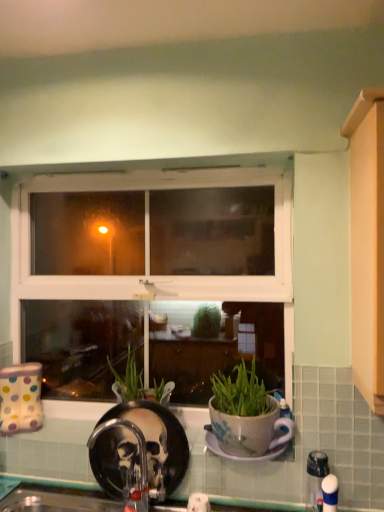
Question: From a real-world perspective, is black matte faucet at lower center, the 1th faucet from the back, below porcelain plate at center?

Choices:
 (A) no
 (B) yes

Answer: (B)

Question: Does black matte faucet at lower center, the 2th faucet positioned from the right, contain porcelain plate at center?

Choices:
 (A) no
 (B) yes

Answer: (A)

Question: From the image's perspective, would you say black matte faucet at lower center, the 1th faucet from the back, is positioned over porcelain plate at center?

Choices:
 (A) yes
 (B) no

Answer: (B)

Question: Is black matte faucet at lower center, the 1th faucet from the back, facing away from porcelain plate at center?

Choices:
 (A) yes
 (B) no

Answer: (B)

Question: Is the surface of black matte faucet at lower center, the 2th faucet positioned from the right, in direct contact with porcelain plate at center?

Choices:
 (A) no
 (B) yes

Answer: (A)

Question: Considering the relative positions of black matte faucet at lower center, the second faucet when ordered from front to back, and porcelain plate at center in the image provided, is black matte faucet at lower center, the second faucet when ordered from front to back, in front of porcelain plate at center?

Choices:
 (A) no
 (B) yes

Answer: (A)

Question: Considering the relative sizes of white plastic window at center and black matte faucet at lower center, the second faucet when ordered from front to back, in the image provided, is white plastic window at center wider than black matte faucet at lower center, the second faucet when ordered from front to back,?

Choices:
 (A) yes
 (B) no

Answer: (A)

Question: Can you confirm if white plastic window at center is shorter than black matte faucet at lower center, the second faucet when ordered from front to back?

Choices:
 (A) yes
 (B) no

Answer: (B)

Question: Considering the relative sizes of white plastic window at center and black matte faucet at lower center, the 1th faucet from the back, in the image provided, is white plastic window at center bigger than black matte faucet at lower center, the 1th faucet from the back,?

Choices:
 (A) no
 (B) yes

Answer: (B)

Question: Is the depth of white plastic window at center greater than that of black matte faucet at lower center, the second faucet when ordered from front to back?

Choices:
 (A) yes
 (B) no

Answer: (A)

Question: Can you see white plastic window at center touching black matte faucet at lower center, the 1th faucet positioned from the left?

Choices:
 (A) no
 (B) yes

Answer: (A)

Question: Does white plastic window at center have a smaller size compared to black matte faucet at lower center, the 2th faucet positioned from the right?

Choices:
 (A) yes
 (B) no

Answer: (B)

Question: Does white plastic faucet at lower right, arranged as the 2th faucet when viewed from the back, appear on the right side of black matte faucet at lower center, the 2th faucet positioned from the right?

Choices:
 (A) yes
 (B) no

Answer: (A)